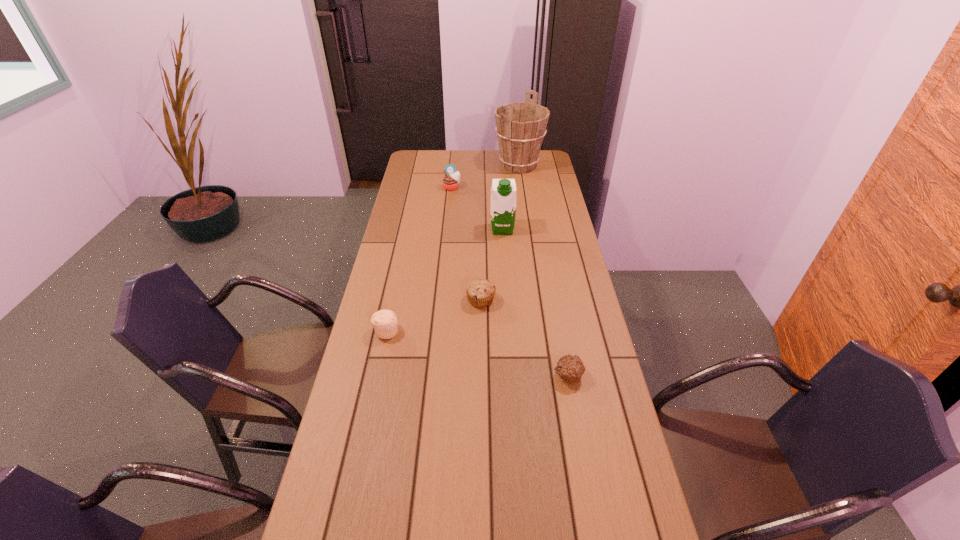
Identify the location of the rightmost muffin. The image size is (960, 540). (570, 368).

Find the location of a particular element. The height and width of the screenshot is (540, 960). the nearest object is located at coordinates (570, 368).

Image resolution: width=960 pixels, height=540 pixels. Find the location of `blank space located on the left of the farthest object`. blank space located on the left of the farthest object is located at coordinates (416, 165).

You are a GUI agent. You are given a task and a screenshot of the screen. Output one action in this format:
    pyautogui.click(x=<x>, y=<y>)
    Task: Click on the vacant space situated 0.090m on the front-facing side of the third farthest object
    The width and height of the screenshot is (960, 540).
    Given the screenshot: What is the action you would take?
    [504, 250]

Image resolution: width=960 pixels, height=540 pixels. What are the coordinates of `vacant space located on the front-facing side of the farthest muffin` in the screenshot? It's located at (449, 219).

The width and height of the screenshot is (960, 540). Identify the location of free location located on the back of the second farthest muffin. (481, 270).

In order to click on vacant space situated on the front of the leftmost object in this screenshot , I will do `click(367, 424)`.

I want to click on free space located on the back of the nearest object, so click(561, 335).

Identify the location of object located at the far edge. This screenshot has width=960, height=540. (520, 126).

This screenshot has height=540, width=960. Identify the location of object that is at the left edge. (384, 322).